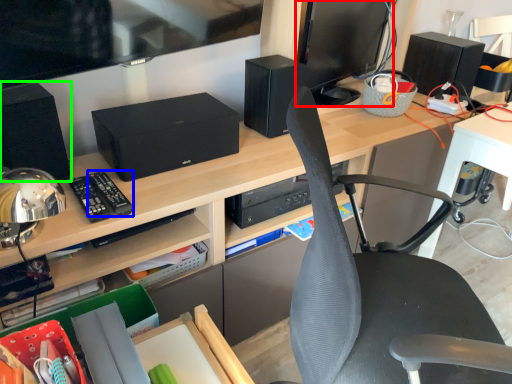
Question: Estimate the real-world distances between objects in this image. Which object is closer to computer monitor (highlighted by a red box), control (highlighted by a blue box) or speaker (highlighted by a green box)?

Choices:
 (A) control
 (B) speaker

Answer: (B)